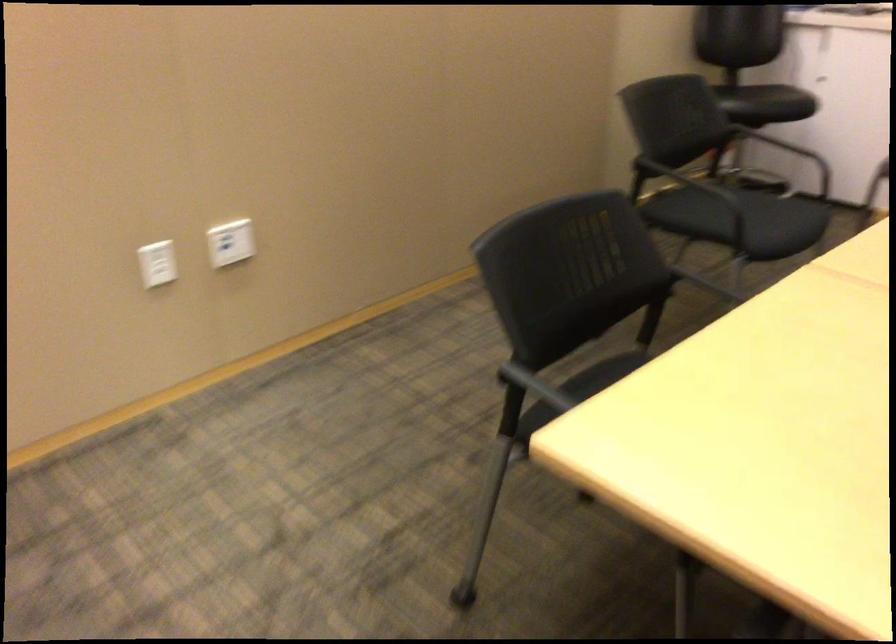
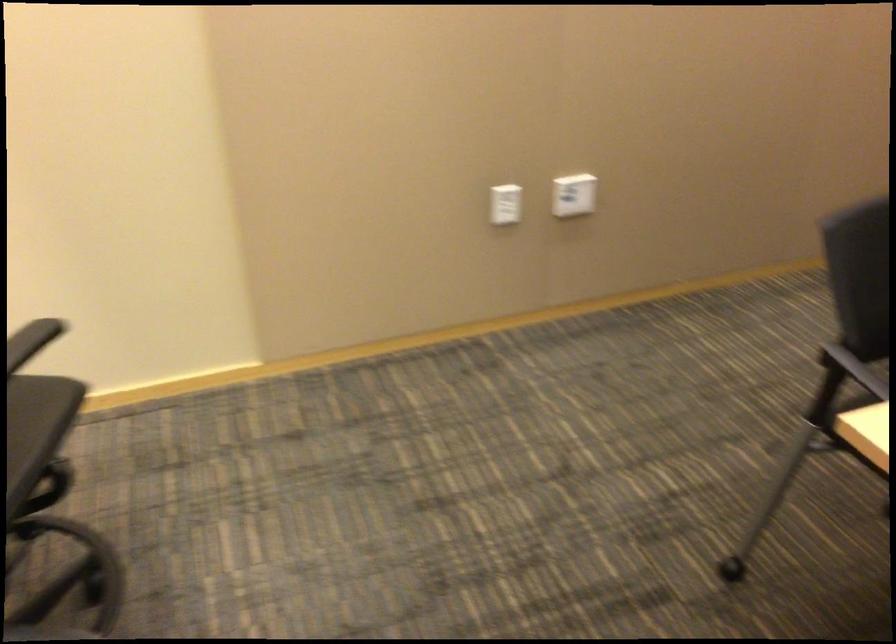
Question: The camera is either moving clockwise (left) or counter-clockwise (right) around the object. The first image is from the beginning of the video and the second image is from the end. Is the camera moving left or right when shooting the video?

Choices:
 (A) Left
 (B) Right

Answer: (B)